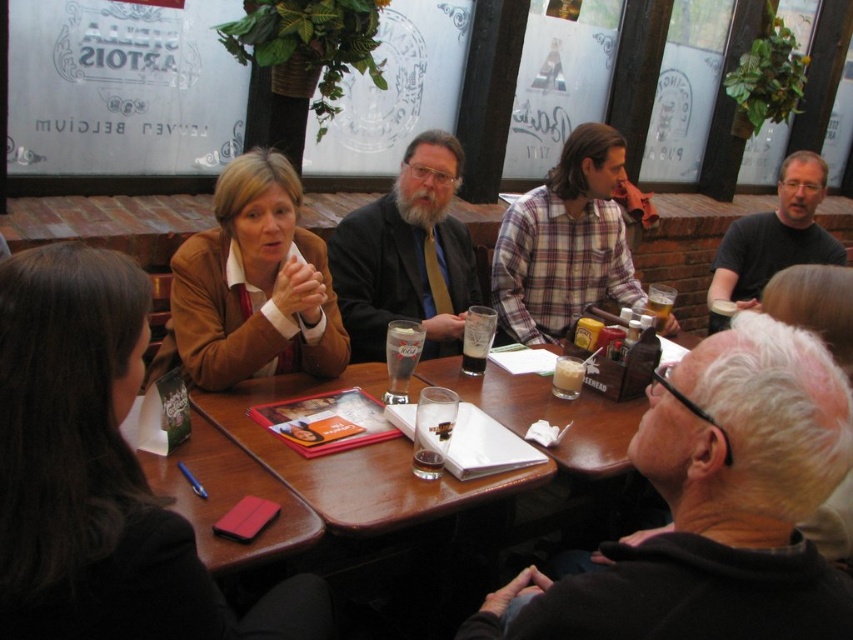
Question: Considering the real-world distances, which object is closest to the plaid fabric shirt at upper center?

Choices:
 (A) black matte shirt at upper right
 (B) wooden table at center
 (C) translucent glass beer at upper center
 (D) brown paper cup at upper right

Answer: (C)

Question: Does matte black jacket at center have a greater width compared to foamy dark beer at center?

Choices:
 (A) no
 (B) yes

Answer: (B)

Question: Can you confirm if white matte hair at upper right is positioned to the right of matte black jacket at center?

Choices:
 (A) yes
 (B) no

Answer: (A)

Question: Which is farther from the translucent glass beer at center?

Choices:
 (A) translucent glass cup at center
 (B) white matte hair at upper right
 (C) foamy dark beer at center
 (D) translucent glass beer at table center

Answer: (B)

Question: Which of the following is the closest to the observer?

Choices:
 (A) foamy dark beer at center
 (B) translucent glass cup at center
 (C) translucent glass beer at center

Answer: (C)

Question: Is foamy dark beer at center below translucent glass beer at upper center?

Choices:
 (A) yes
 (B) no

Answer: (A)